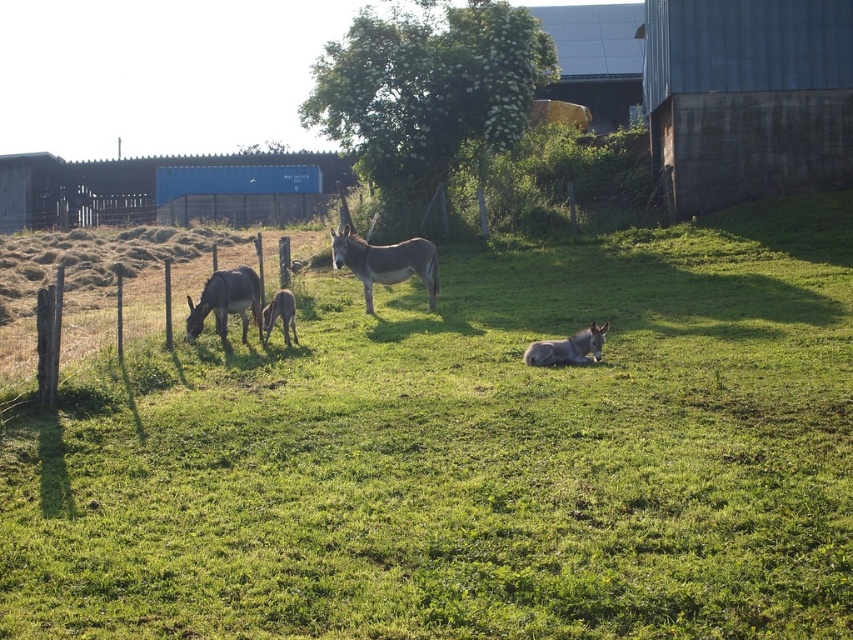
Does green grassy at center lie behind gray matte mule at lower left?

No, it is in front of gray matte mule at lower left.

Looking at this image, does green grassy at center appear on the left side of gray matte mule at lower left?

In fact, green grassy at center is to the right of gray matte mule at lower left.

Is point (126, 564) less distant than point (221, 292)?

Yes, it is in front of point (221, 292).

Where is `green grassy at center`? green grassy at center is located at coordinates (473, 456).

You are a GUI agent. You are given a task and a screenshot of the screen. Output one action in this format:
    pyautogui.click(x=<x>, y=<y>)
    Task: Click on the gray matte donkey at center
    This screenshot has width=853, height=640.
    Given the screenshot: What is the action you would take?
    pyautogui.click(x=386, y=262)

Does gray matte donkey at center have a greater width compared to gray matte mule at lower left?

Correct, the width of gray matte donkey at center exceeds that of gray matte mule at lower left.

Who is more distant from viewer, (397, 259) or (241, 285)?

Positioned behind is point (397, 259).

Where is `gray matte donkey at center`? gray matte donkey at center is located at coordinates (386, 262).

Is point (433, 493) positioned before point (265, 328)?

Yes, it is in front of point (265, 328).

Can you confirm if green grassy at center is thinner than gray matte mule at center?

In fact, green grassy at center might be wider than gray matte mule at center.

At what (x,y) coordinates should I click in order to perform the action: click on green grassy at center. Please return your answer as a coordinate pair (x, y). Looking at the image, I should click on (473, 456).